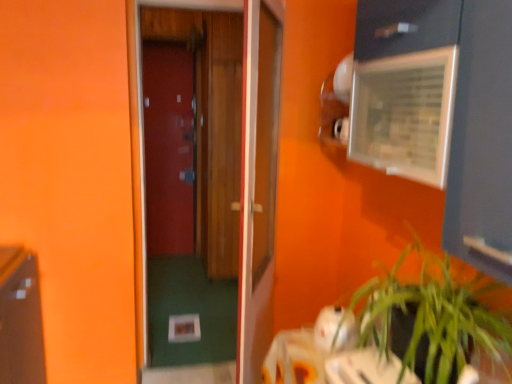
Question: Relative to wooden door at center, the second door viewed from the back, is matte wood door at center, which is the 1th door from left to right, in front or behind?

Choices:
 (A) behind
 (B) front

Answer: (A)

Question: From the image's perspective, is matte wood door at center, the 1th door when ordered from back to front, above or below wooden door at center, the second door viewed from the back?

Choices:
 (A) above
 (B) below

Answer: (A)

Question: Considering the real-world distances, which object is farthest from the wooden door at center, the second door viewed from the back?

Choices:
 (A) green leafy plant at lower right
 (B) matte wood door at center, which is the 1th door from left to right
 (C) wooden door at center, which is the 3th door in back-to-front order
 (D) clear plastic medicine cabinet at upper right

Answer: (D)

Question: Estimate the real-world distances between objects in this image. Which object is closer to the wooden door at center, which is the second door in right-to-left order?

Choices:
 (A) wooden door at center, which is the 3th door in back-to-front order
 (B) clear plastic medicine cabinet at upper right
 (C) green leafy plant at lower right
 (D) matte wood door at center, which is the 1th door from left to right

Answer: (D)